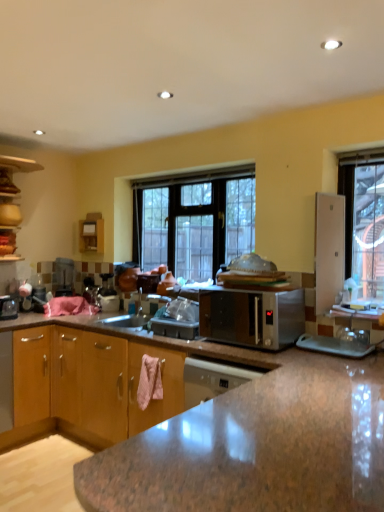
Question: From the image's perspective, relative to satin silver microwave at center, is wooden cabinet at left, which ranks as the 1th cabinetry in back-to-front order, above or below?

Choices:
 (A) below
 (B) above

Answer: (B)

Question: Considering the relative positions of wooden cabinet at left, marked as the 2th cabinetry in a bottom-to-top arrangement, and satin silver microwave at center in the image provided, is wooden cabinet at left, marked as the 2th cabinetry in a bottom-to-top arrangement, to the left or to the right of satin silver microwave at center?

Choices:
 (A) left
 (B) right

Answer: (A)

Question: Based on their relative distances, which object is nearer to the satin silver microwave at center?

Choices:
 (A) brown wood cabinet at lower left, placed as the 1th cabinetry when sorted from front to back
 (B) clear glass window at center
 (C) wooden cabinet at left, marked as the 2th cabinetry in a bottom-to-top arrangement

Answer: (A)

Question: Which of these objects is positioned closest to the wooden cabinet at left, which ranks as the 1th cabinetry in back-to-front order?

Choices:
 (A) clear glass window at center
 (B) brown wood cabinet at lower left, acting as the second cabinetry starting from the top
 (C) satin silver microwave at center

Answer: (A)